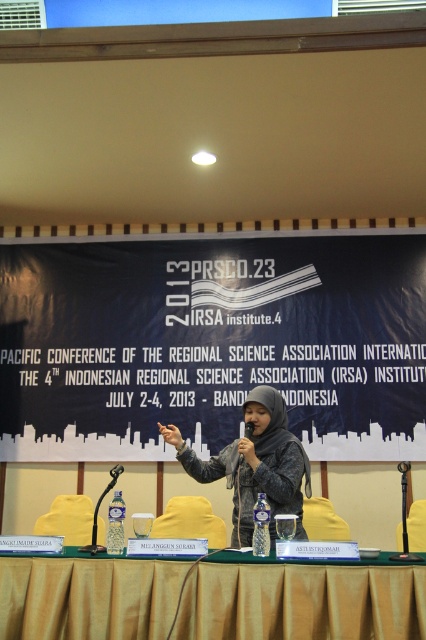
Consider the image. You are an attendee at the conference and want to ask the speaker a question. You need to walk to the front of the stage. Which object should you approach first, the gold fabric table at center or the black plastic microphone at center?

The gold fabric table at center is located below the black plastic microphone at center, so you should approach the black plastic microphone at center first as it is closer to the speaker.

You are a photographer at the conference and need to capture a photo of the gold fabric table at center and the matte gray hoodie at center. The camera you are using has a minimum focus distance of 32 inches. Will you be able to focus on both objects clearly in the same shot?

The gold fabric table at center and matte gray hoodie at center are 31.89 inches apart from each other. Since the minimum focus distance is 32 inches, the camera cannot focus on both objects clearly in the same shot because they are slightly closer than the required distance.

What is the spatial coordinate of the gold fabric table at center in the image?

The gold fabric table at center is located at the coordinate point of (302, 602).